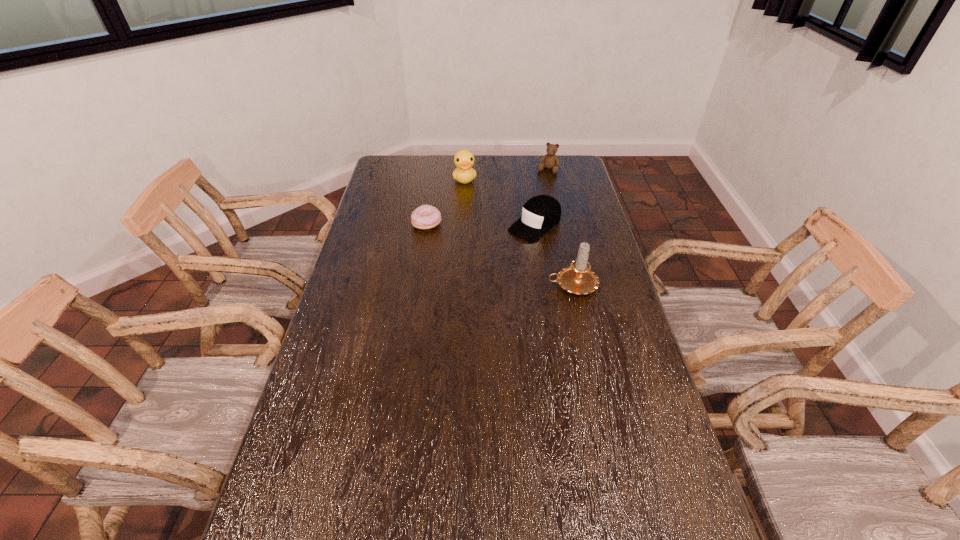
Where is `vacant spot on the desktop that is between the leftmost object and the tallest object and is positioned on the front-facing side of the teddy bear`? This screenshot has width=960, height=540. vacant spot on the desktop that is between the leftmost object and the tallest object and is positioned on the front-facing side of the teddy bear is located at coordinates coord(500,254).

I want to click on free space on the desktop that is between the shortest object and the candle and is positioned on the face of the second object from left to right, so click(475, 244).

This screenshot has width=960, height=540. In order to click on vacant spot on the desktop that is between the doughnut and the nearest object and is positioned on the front-facing side of the cap in this screenshot , I will do `click(498, 254)`.